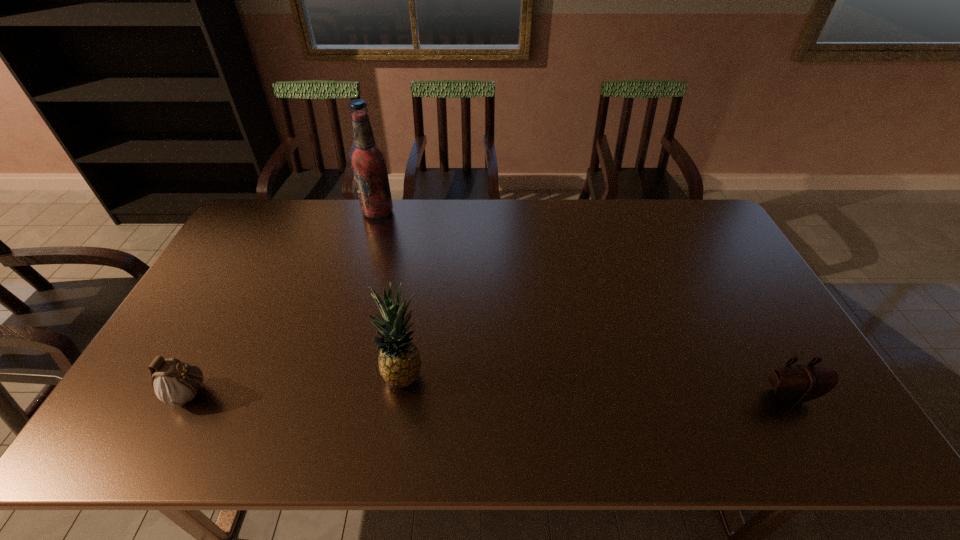
The width and height of the screenshot is (960, 540). I want to click on vacant area that lies between the alcohol and the rightmost object, so click(584, 304).

Identify the location of empty space between the leftmost object and the pineapple. Image resolution: width=960 pixels, height=540 pixels. (299, 384).

The height and width of the screenshot is (540, 960). In order to click on vacant space that is in between the second tallest object and the right pouch in this screenshot , I will do `click(596, 386)`.

Locate an element on the screen. Image resolution: width=960 pixels, height=540 pixels. free spot between the rightmost object and the second object from left to right is located at coordinates (584, 304).

You are a GUI agent. You are given a task and a screenshot of the screen. Output one action in this format:
    pyautogui.click(x=<x>, y=<y>)
    Task: Click on the unoccupied position between the second object from left to right and the rightmost object
    
    Given the screenshot: What is the action you would take?
    pyautogui.click(x=584, y=304)

The height and width of the screenshot is (540, 960). Find the location of `free space between the alcohol and the rightmost object`. free space between the alcohol and the rightmost object is located at coordinates (584, 304).

You are a GUI agent. You are given a task and a screenshot of the screen. Output one action in this format:
    pyautogui.click(x=<x>, y=<y>)
    Task: Click on the empty location between the rightmost object and the leftmost object
    The width and height of the screenshot is (960, 540).
    Given the screenshot: What is the action you would take?
    pyautogui.click(x=491, y=395)

Locate an element on the screen. The image size is (960, 540). object that is the second closest one to the farthest object is located at coordinates (175, 383).

Locate which object is the second closest to the left pouch. Please provide its 2D coordinates. Your answer should be formatted as a tuple, i.e. [(x, y)], where the tuple contains the x and y coordinates of a point satisfying the conditions above.

[(368, 162)]

Identify the location of free space that satisfies the following two spatial constraints: 1. on the front side of the alcohol; 2. on the right side of the second tallest object. The height and width of the screenshot is (540, 960). (x=332, y=375).